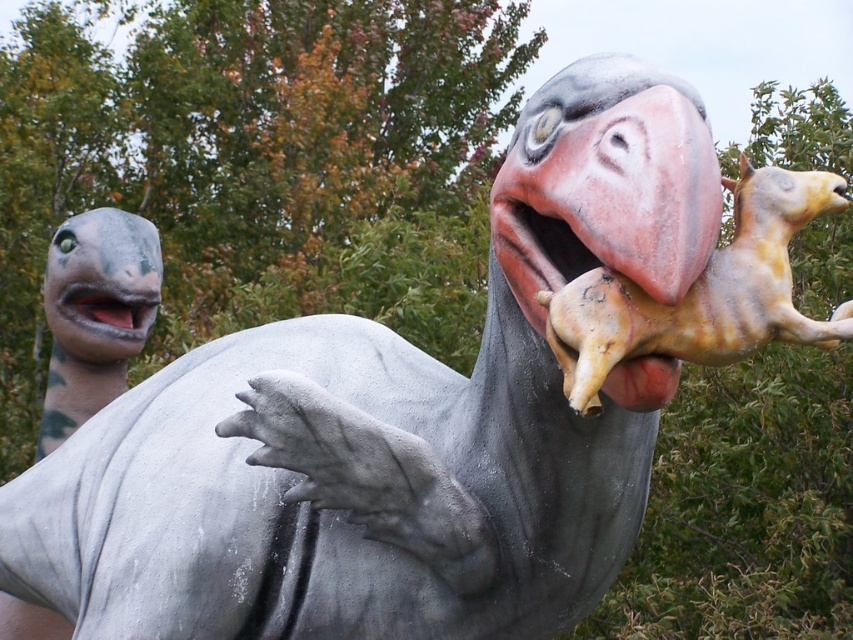
Question: Which point appears closest to the camera in this image?

Choices:
 (A) (109, 301)
 (B) (788, 182)

Answer: (B)

Question: Which point appears closest to the camera in this image?

Choices:
 (A) (759, 332)
 (B) (132, 353)

Answer: (A)

Question: Can you confirm if speckled yellowish-brown horse at upper right is smaller than matte gray mouth at left?

Choices:
 (A) yes
 (B) no

Answer: (B)

Question: Does speckled yellowish-brown horse at upper right have a lesser width compared to matte gray mouth at left?

Choices:
 (A) yes
 (B) no

Answer: (B)

Question: Can you confirm if speckled yellowish-brown horse at upper right is positioned to the right of matte gray mouth at left?

Choices:
 (A) yes
 (B) no

Answer: (A)